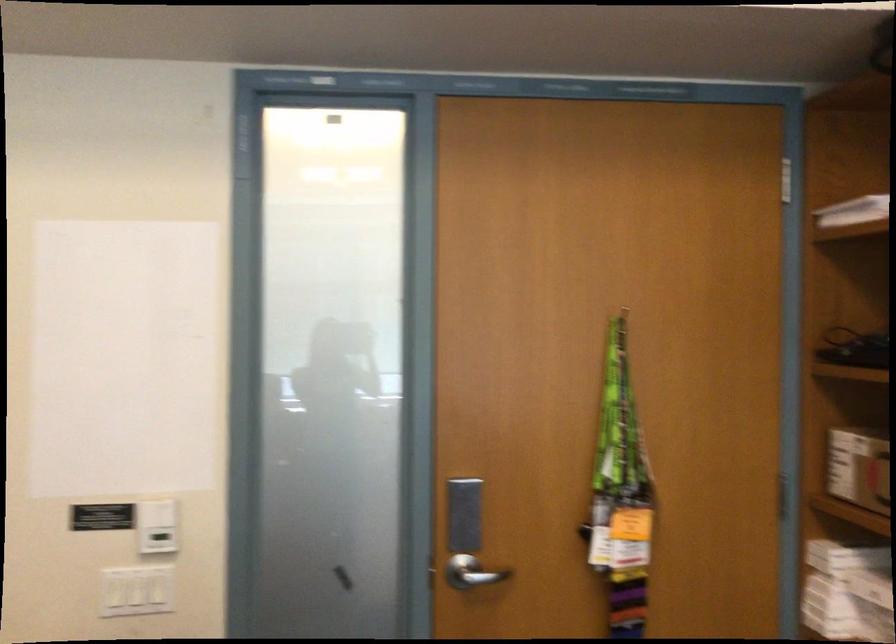
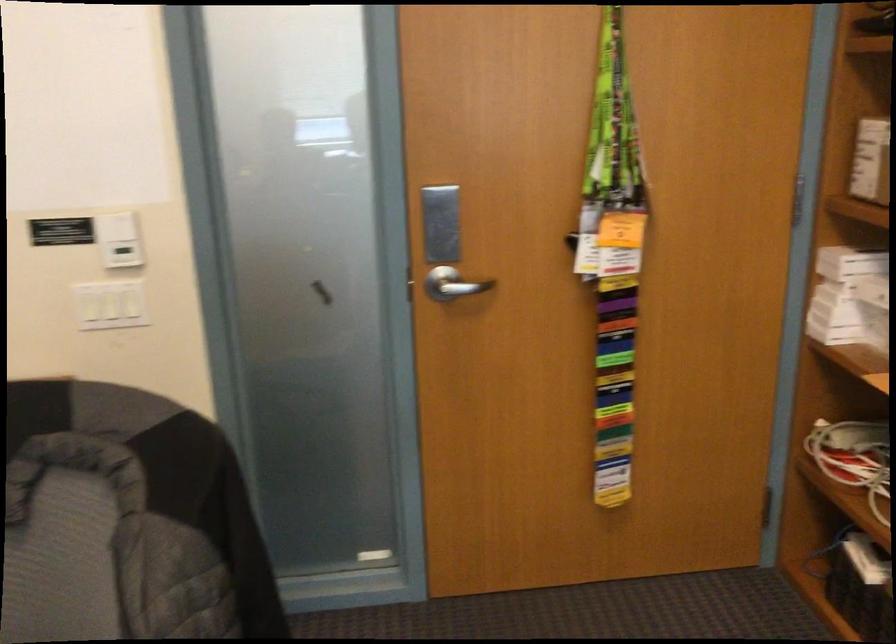
Question: The first image is from the beginning of the video and the second image is from the end. How did the camera likely rotate when shooting the video?

Choices:
 (A) Left
 (B) Right
 (C) Up
 (D) Down

Answer: (D)